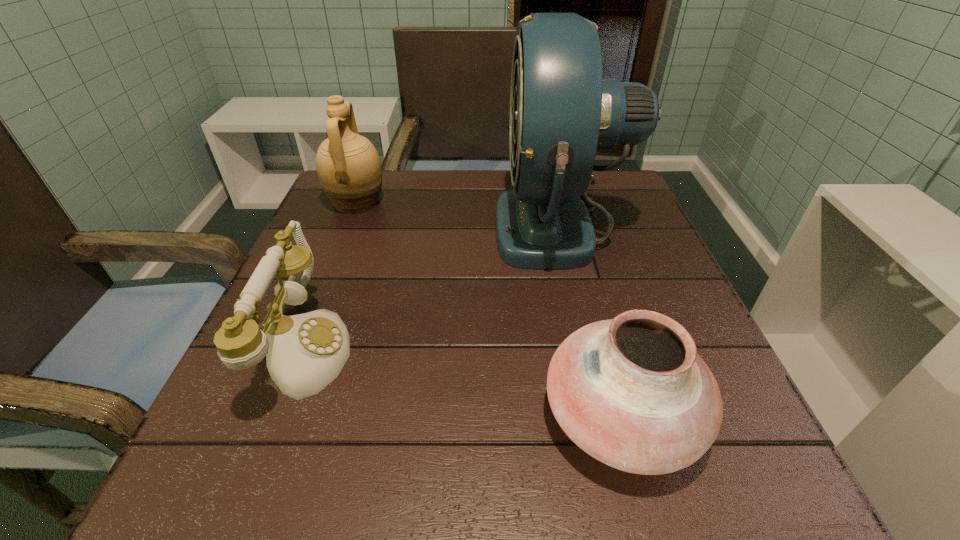
Identify the location of fan. The height and width of the screenshot is (540, 960). (562, 111).

The height and width of the screenshot is (540, 960). I want to click on pitcher, so click(x=349, y=168).

Image resolution: width=960 pixels, height=540 pixels. I want to click on telephone, so click(304, 353).

I want to click on pottery, so click(632, 392).

Locate an element on the screen. This screenshot has height=540, width=960. vacant space situated in front of the tallest object to blow air is located at coordinates (433, 225).

Find the location of a particular element. This screenshot has height=540, width=960. free space located in front of the tallest object to blow air is located at coordinates point(326,225).

I want to click on free space located in front of the tallest object to blow air, so click(x=357, y=225).

Where is `vacant point located 0.240m on the right of the third shortest object`? Image resolution: width=960 pixels, height=540 pixels. vacant point located 0.240m on the right of the third shortest object is located at coordinates (486, 202).

I want to click on free space located 0.400m on the dial of the telephone, so click(x=596, y=348).

This screenshot has width=960, height=540. Identify the location of vacant area situated on the back of the pottery. (567, 218).